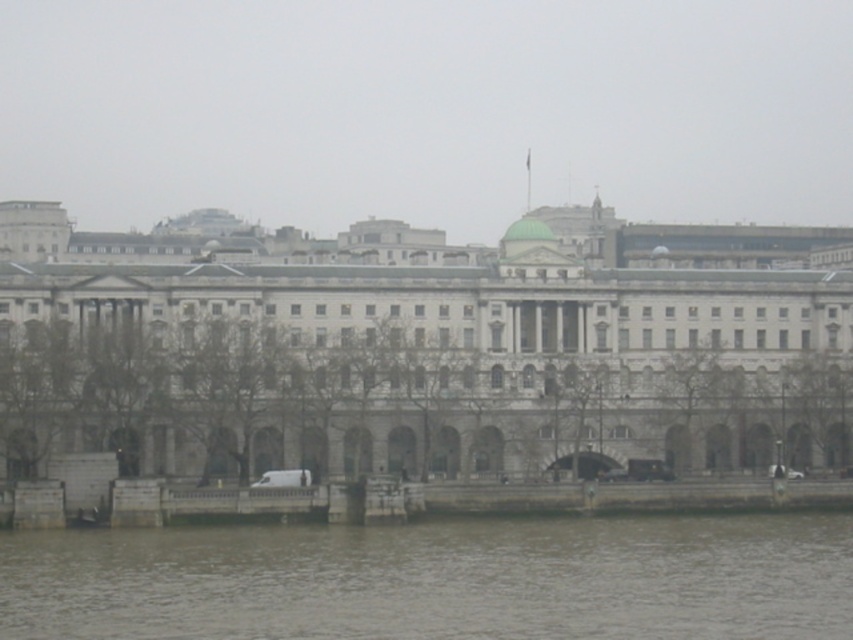
Question: Can you confirm if white stone building at center is wider than gray water at lower center?

Choices:
 (A) no
 (B) yes

Answer: (B)

Question: Is white stone building at center wider than gray water at lower center?

Choices:
 (A) no
 (B) yes

Answer: (B)

Question: Which point is closer to the camera?

Choices:
 (A) gray water at lower center
 (B) white stone building at center

Answer: (A)

Question: Which point is farther to the camera?

Choices:
 (A) (666, 598)
 (B) (541, 241)

Answer: (B)

Question: Is white stone building at center below gray water at lower center?

Choices:
 (A) yes
 (B) no

Answer: (B)